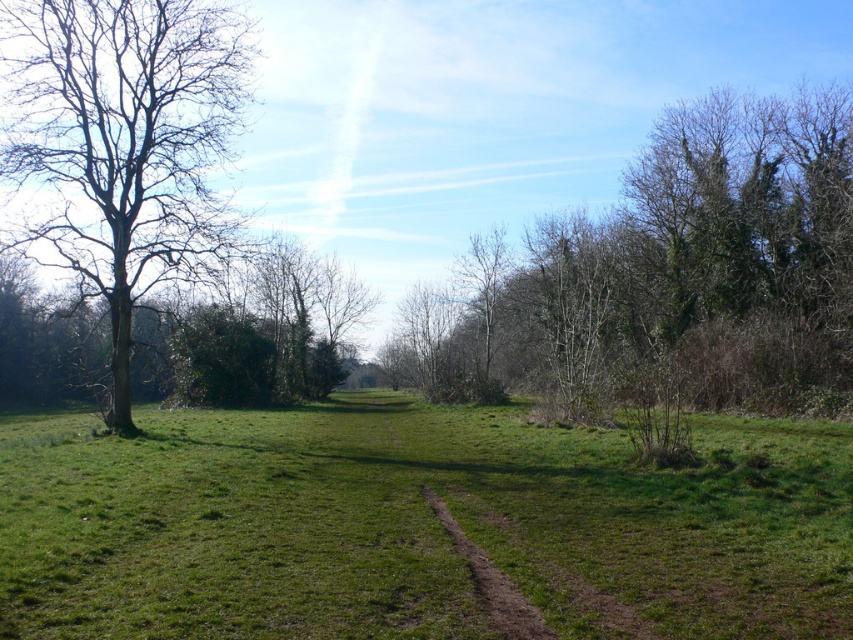
Does bare branches at upper right appear on the left side of bare wood tree at left?

In fact, bare branches at upper right is to the right of bare wood tree at left.

Does point (849, 332) lie behind point (65, 3)?

Yes, it is.

Which is in front, point (548, 372) or point (16, 173)?

Point (16, 173)

In order to click on bare branches at upper right in this screenshot , I will do `click(677, 273)`.

Based on the photo, which is more to the left, green grass at center or bare wood tree at left?

bare wood tree at left

Who is higher up, green grass at center or bare wood tree at left?

bare wood tree at left

Describe the element at coordinates (415, 524) in the screenshot. This screenshot has height=640, width=853. I see `green grass at center` at that location.

You are a GUI agent. You are given a task and a screenshot of the screen. Output one action in this format:
    pyautogui.click(x=<x>, y=<y>)
    Task: Click on the green grass at center
    The image size is (853, 640).
    Given the screenshot: What is the action you would take?
    pyautogui.click(x=415, y=524)

Which is behind, point (120, 547) or point (509, 282)?

The point (509, 282) is more distant.

Is point (494, 554) less distant than point (627, 344)?

Yes, it is in front of point (627, 344).

Find the location of a particular element. Image resolution: width=853 pixels, height=640 pixels. green grass at center is located at coordinates (415, 524).